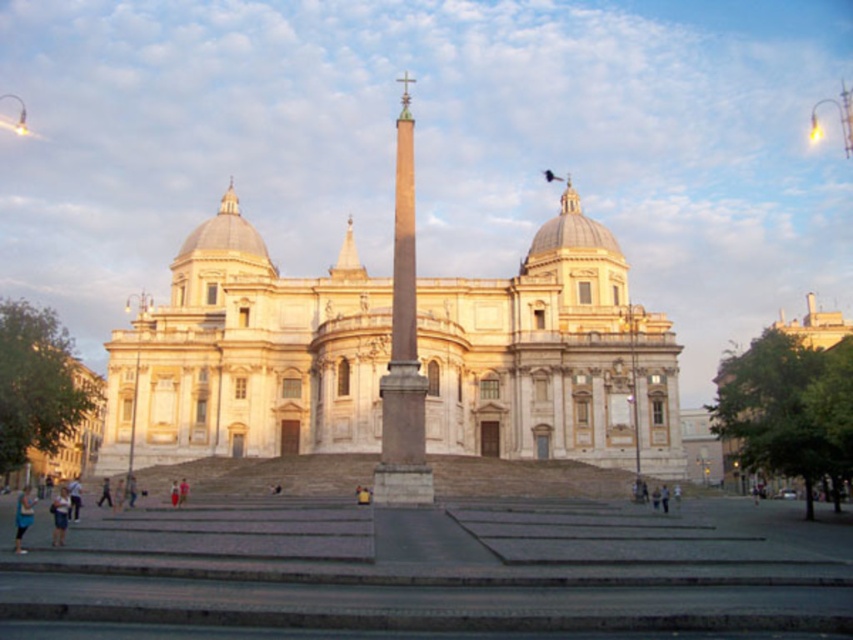
Question: Which of the following is the closest to the observer?

Choices:
 (A) (59, 493)
 (B) (554, 227)
 (C) (19, 531)
 (D) (403, 188)

Answer: (C)

Question: Which of the following is the closest to the observer?

Choices:
 (A) blue denim jeans at lower left
 (B) smooth stone obelisk at center
 (C) light blue denim shorts at lower left
 (D) white marble church at center

Answer: (A)

Question: Can you confirm if smooth stone obelisk at center is positioned above blue denim jeans at lower left?

Choices:
 (A) yes
 (B) no

Answer: (A)

Question: Is blue denim jeans at lower left behind skinny jeans at lower left?

Choices:
 (A) no
 (B) yes

Answer: (A)

Question: Is white marble church at center below blue denim jeans at lower left?

Choices:
 (A) yes
 (B) no

Answer: (B)

Question: Among these points, which one is farthest from the camera?

Choices:
 (A) (28, 509)
 (B) (517, 348)
 (C) (404, 369)
 (D) (57, 496)

Answer: (D)